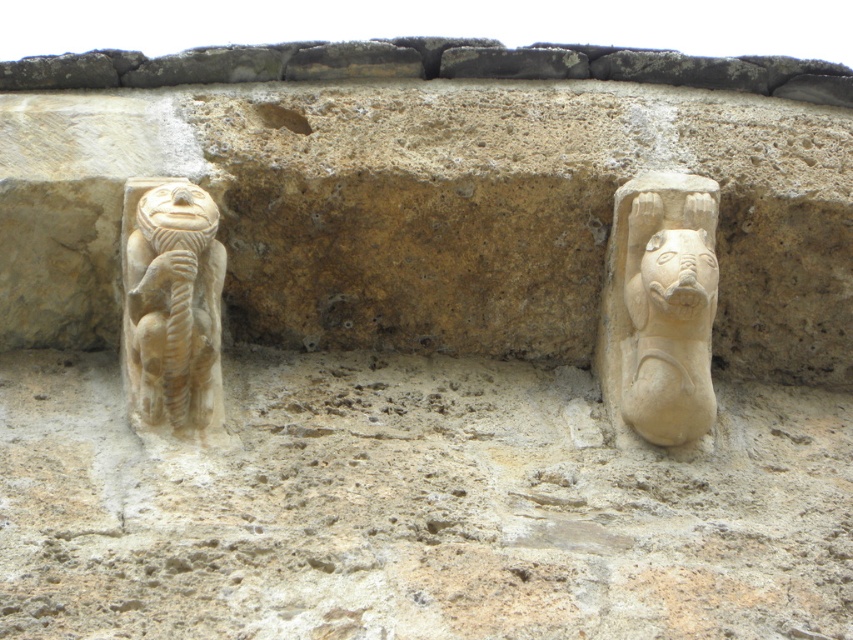
Between beige stone lion at right and beige stone monkey at left, which one has more height?

With more height is beige stone monkey at left.

The width and height of the screenshot is (853, 640). I want to click on beige stone lion at right, so click(x=659, y=308).

The height and width of the screenshot is (640, 853). I want to click on beige stone lion at right, so click(659, 308).

Locate an element on the screen. The width and height of the screenshot is (853, 640). beige stone lion at right is located at coordinates (659, 308).

Between beige stone monkey at left and white stone face at right, which one has more height?

beige stone monkey at left

Does point (144, 300) come in front of point (714, 278)?

That is True.

Describe the element at coordinates (171, 304) in the screenshot. The height and width of the screenshot is (640, 853). I see `beige stone monkey at left` at that location.

At what (x,y) coordinates should I click in order to perform the action: click on beige stone monkey at left. Please return your answer as a coordinate pair (x, y). Looking at the image, I should click on (171, 304).

Between point (683, 406) and point (689, 314), which one is positioned in front?

Point (689, 314) is in front.

This screenshot has width=853, height=640. In order to click on beige stone lion at right in this screenshot , I will do `click(659, 308)`.

The height and width of the screenshot is (640, 853). Identify the location of beige stone lion at right. (659, 308).

At what (x,y) coordinates should I click in order to perform the action: click on beige stone lion at right. Please return your answer as a coordinate pair (x, y). Looking at the image, I should click on 659,308.